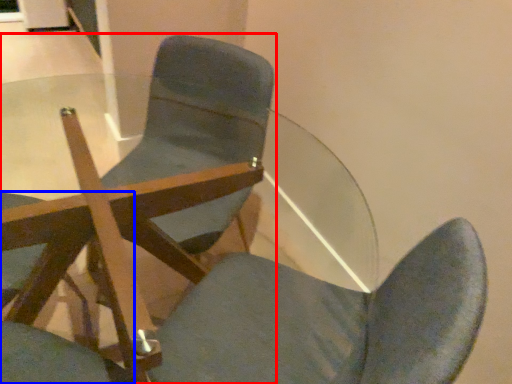
Question: Among these objects, which one is farthest to the camera, chair (highlighted by a red box) or chair (highlighted by a blue box)?

Choices:
 (A) chair
 (B) chair

Answer: (A)